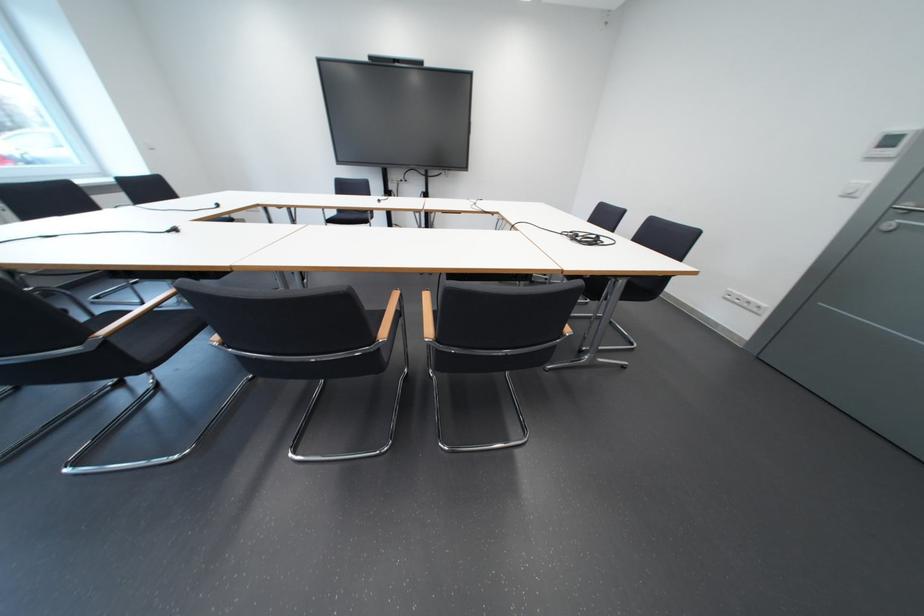
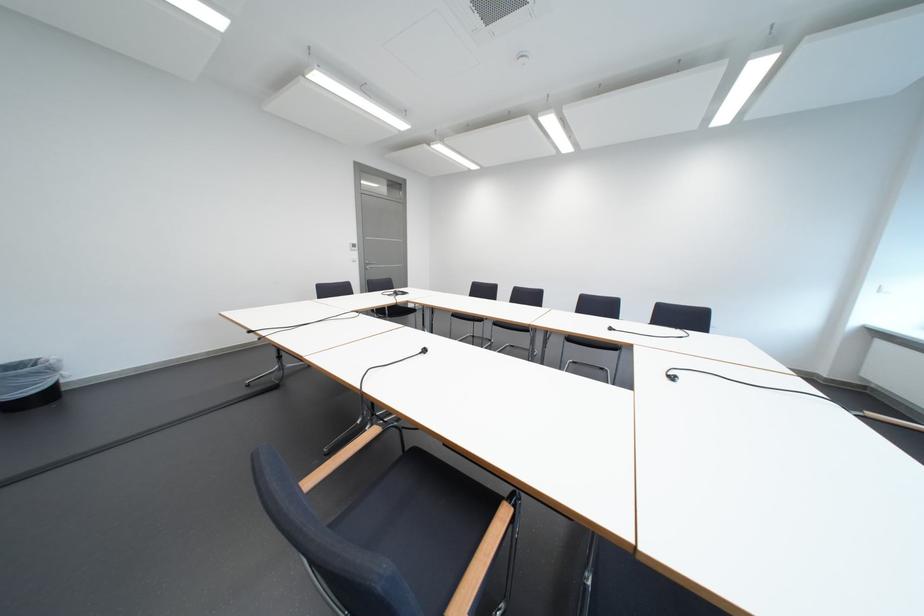
The point at [864,208] is marked in the first image. Where is the corresponding point in the second image?

(369, 265)